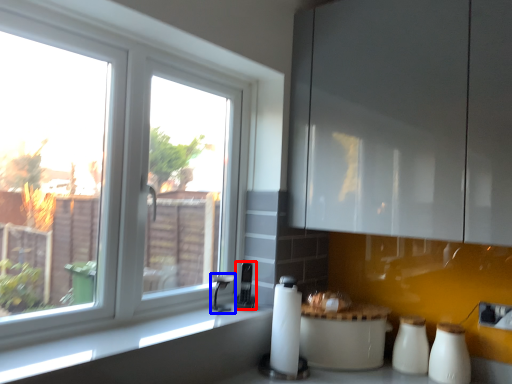
Question: Which of the following is the farthest to the observer, appliance (highlighted by a red box) or faucet (highlighted by a blue box)?

Choices:
 (A) appliance
 (B) faucet

Answer: (A)